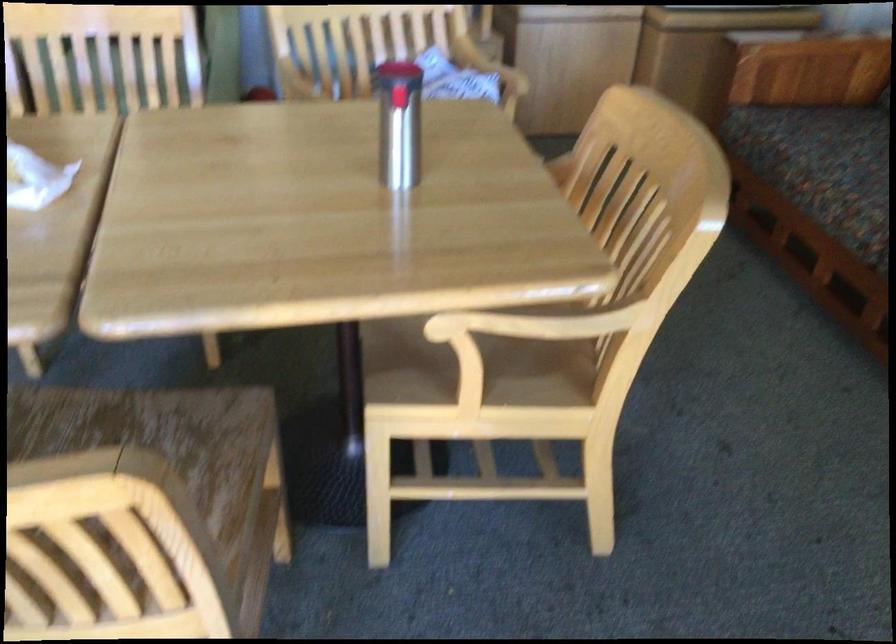
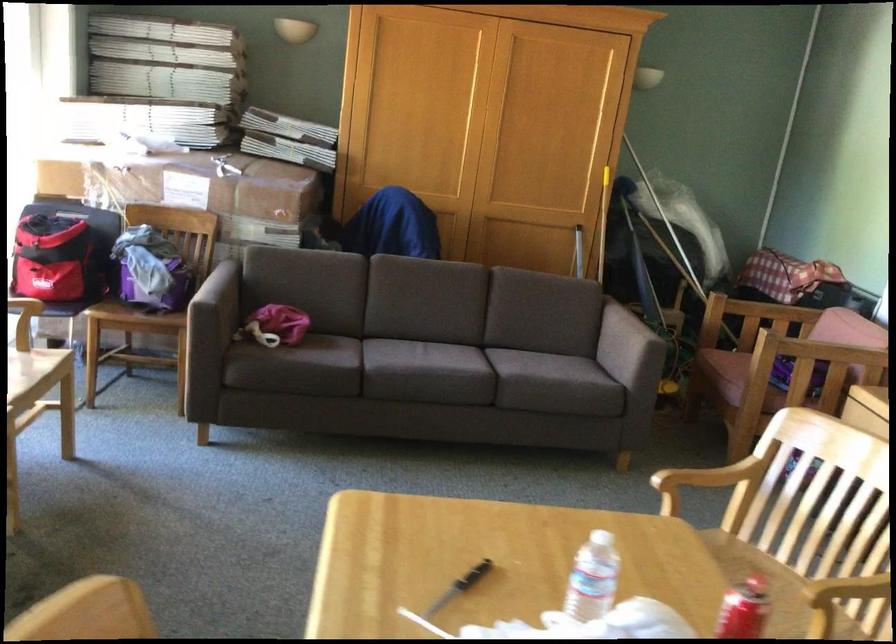
The first image is from the beginning of the video and the second image is from the end. How did the camera likely rotate when shooting the video?

The camera's rotation is toward left-down.